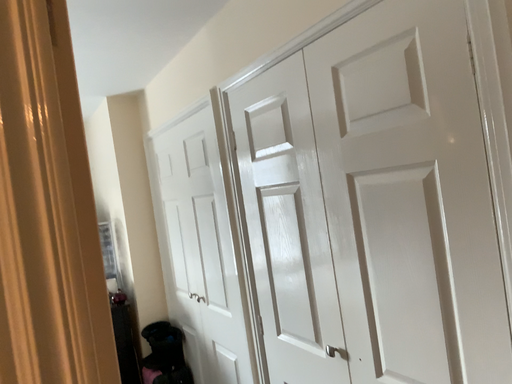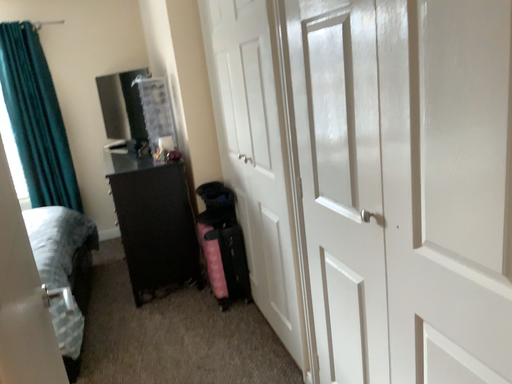
Question: Which way did the camera rotate in the video?

Choices:
 (A) rotated downward
 (B) rotated upward

Answer: (A)